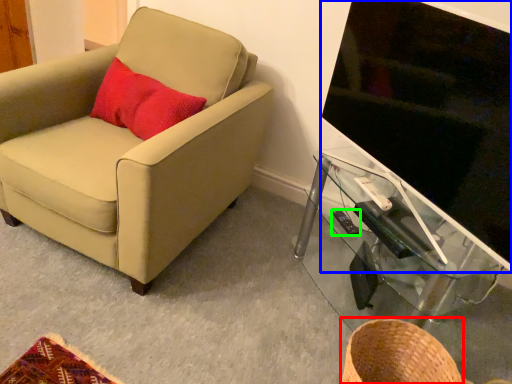
Question: Which object is the farthest from basket (highlighted by a red box)? Choose among these: television (highlighted by a blue box) or remote control (highlighted by a green box).

Choices:
 (A) television
 (B) remote control

Answer: (A)